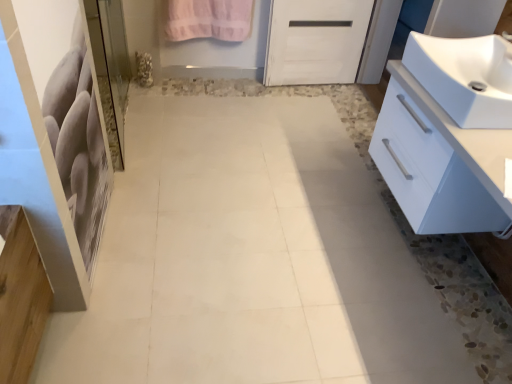
Question: Does pink cotton towel at upper center come in front of white glossy cabinet at right?

Choices:
 (A) no
 (B) yes

Answer: (A)

Question: Can you confirm if pink cotton towel at upper center is bigger than white glossy cabinet at right?

Choices:
 (A) no
 (B) yes

Answer: (A)

Question: Is pink cotton towel at upper center turned away from white glossy cabinet at right?

Choices:
 (A) yes
 (B) no

Answer: (B)

Question: Are pink cotton towel at upper center and white glossy cabinet at right making contact?

Choices:
 (A) yes
 (B) no

Answer: (B)

Question: Is white glossy cabinet at right a part of pink cotton towel at upper center?

Choices:
 (A) yes
 (B) no

Answer: (B)

Question: From the image's perspective, does pink cotton towel at upper center appear lower than white glossy cabinet at right?

Choices:
 (A) yes
 (B) no

Answer: (B)

Question: Could white glossy cabinet at right be considered to be inside white glossy sink at right?

Choices:
 (A) no
 (B) yes

Answer: (A)

Question: From the image's perspective, would you say white glossy sink at right is positioned over white glossy cabinet at right?

Choices:
 (A) yes
 (B) no

Answer: (A)

Question: Does white glossy sink at right appear on the left side of white glossy cabinet at right?

Choices:
 (A) yes
 (B) no

Answer: (B)

Question: Can you confirm if white glossy sink at right is taller than white glossy cabinet at right?

Choices:
 (A) no
 (B) yes

Answer: (A)

Question: From the image's perspective, is white glossy sink at right beneath white glossy cabinet at right?

Choices:
 (A) yes
 (B) no

Answer: (B)

Question: From a real-world perspective, is white glossy sink at right under white glossy cabinet at right?

Choices:
 (A) yes
 (B) no

Answer: (B)

Question: Is white glossy cabinet at right positioned with its back to pink cotton towel at upper center?

Choices:
 (A) no
 (B) yes

Answer: (A)